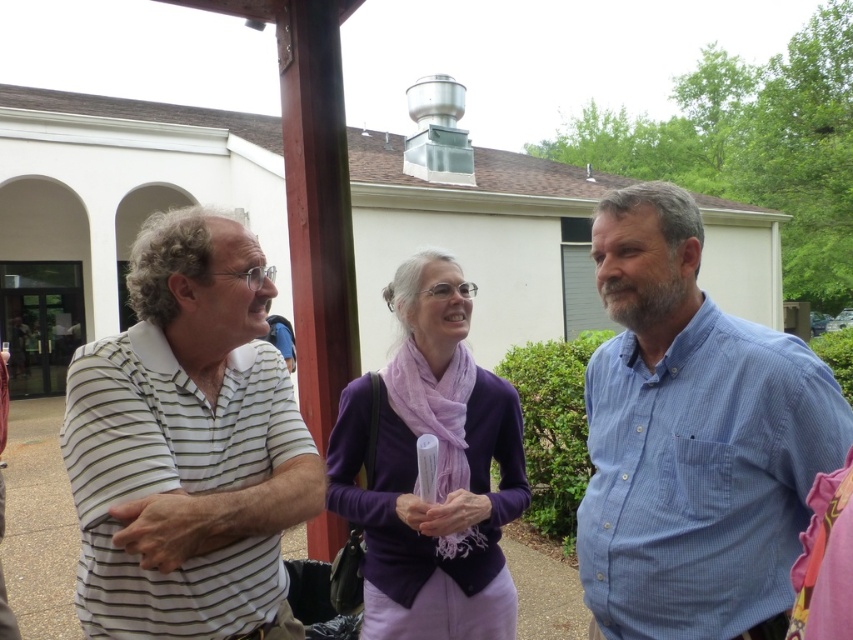
You are standing in the same location as the people in the image and want to greet both the blue striped shirt at right and the white striped polo shirt at left. Which direction should you move to first approach the person closer to you?

The blue striped shirt at right is to the right of the white striped polo shirt at left, so the white striped polo shirt at left is closer to you. You should move towards the left to first approach the white striped polo shirt at left.

You are a photographer trying to capture a group photo of the blue striped shirt at right and the white striped polo shirt at left. Based on their heights, which person should stand behind the other to ensure both are fully visible in the photo?

The blue striped shirt at right is much taller than the white striped polo shirt at left, so the taller individual with the blue striped shirt at right should stand behind the shorter one to ensure both are fully visible in the photo.

You are standing at the point labeled point (692, 438) in the image. Which person are you closest to?

You are closest to the man wearing a horizontally striped polo shirt at left because the point (692, 438) is located on his white striped shirt.